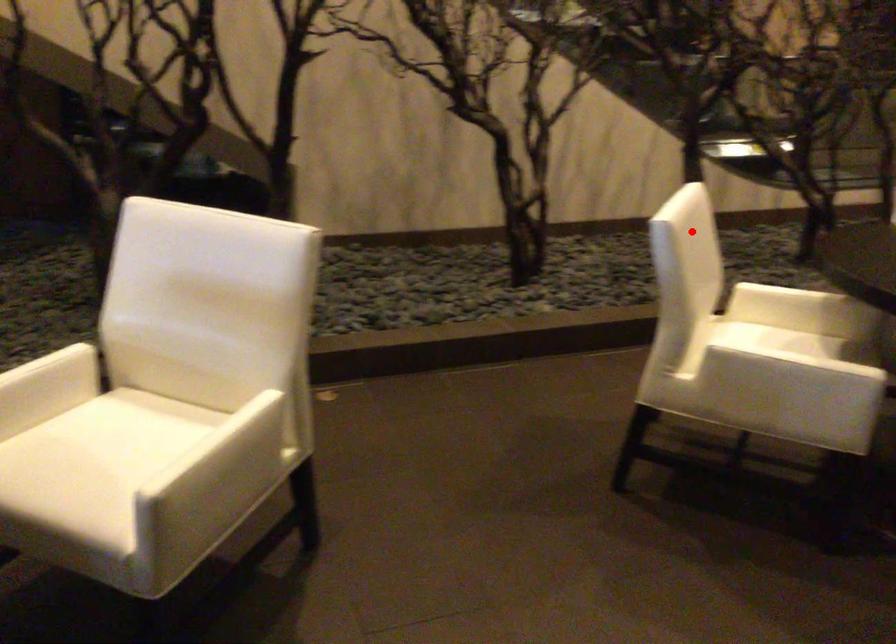
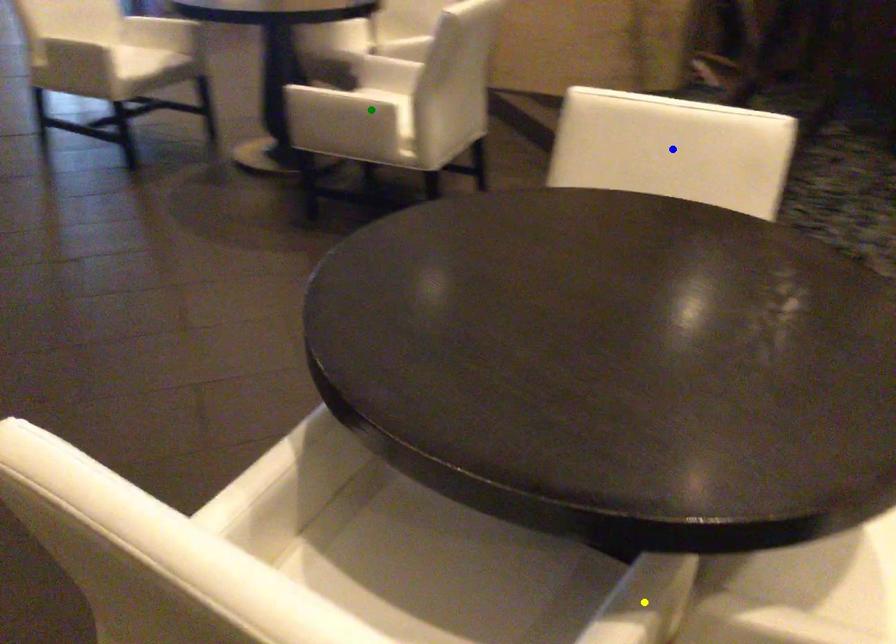
Question: I am providing you with two images of the same scene from different viewpoints. A red point is marked on the first image. You are given multiple points on the second image. Which point in image 2 is actually the same real-world point as the red point in image 1?

Choices:
 (A) blue point
 (B) yellow point
 (C) green point

Answer: (A)